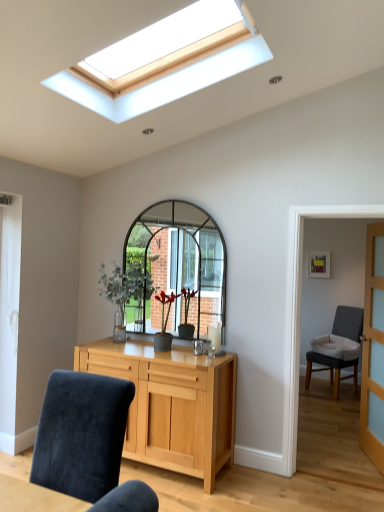
Where is `unoccupied space behind clear glass door at right`? Image resolution: width=384 pixels, height=512 pixels. unoccupied space behind clear glass door at right is located at coordinates (341, 441).